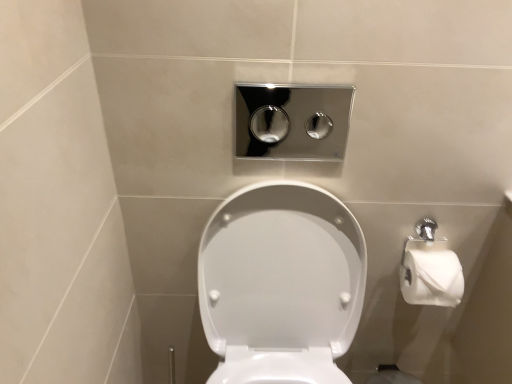
Question: Could you tell me if white glossy toilet at center is facing polished chrome flush buttons at upper center?

Choices:
 (A) yes
 (B) no

Answer: (B)

Question: Is white glossy toilet at center taller than polished chrome flush buttons at upper center?

Choices:
 (A) yes
 (B) no

Answer: (A)

Question: Is white glossy toilet at center smaller than polished chrome flush buttons at upper center?

Choices:
 (A) yes
 (B) no

Answer: (B)

Question: From the image's perspective, is white glossy toilet at center beneath polished chrome flush buttons at upper center?

Choices:
 (A) no
 (B) yes

Answer: (B)

Question: From the image's perspective, is white glossy toilet at center over polished chrome flush buttons at upper center?

Choices:
 (A) yes
 (B) no

Answer: (B)

Question: Is white glossy toilet at center shorter than polished chrome flush buttons at upper center?

Choices:
 (A) no
 (B) yes

Answer: (A)

Question: Does polished chrome flush buttons at upper center appear on the left side of white glossy toilet at center?

Choices:
 (A) no
 (B) yes

Answer: (A)

Question: Is polished chrome flush buttons at upper center facing towards white glossy toilet at center?

Choices:
 (A) yes
 (B) no

Answer: (B)

Question: Does polished chrome flush buttons at upper center appear on the right side of white glossy toilet at center?

Choices:
 (A) yes
 (B) no

Answer: (A)

Question: Is polished chrome flush buttons at upper center positioned with its back to white glossy toilet at center?

Choices:
 (A) no
 (B) yes

Answer: (A)

Question: Is polished chrome flush buttons at upper center far away from white glossy toilet at center?

Choices:
 (A) yes
 (B) no

Answer: (B)

Question: From the image's perspective, is polished chrome flush buttons at upper center above white glossy toilet at center?

Choices:
 (A) no
 (B) yes

Answer: (B)

Question: From a real-world perspective, is polished chrome flush buttons at upper center positioned above or below white glossy toilet at center?

Choices:
 (A) below
 (B) above

Answer: (B)